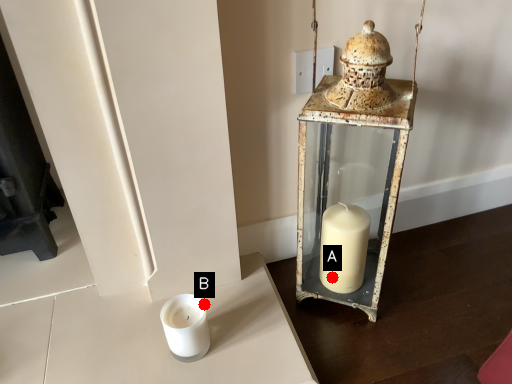
Question: Two points are circled on the image, labeled by A and B beside each circle. Which point is farther from the camera taking this photo?

Choices:
 (A) A is further
 (B) B is further

Answer: (A)